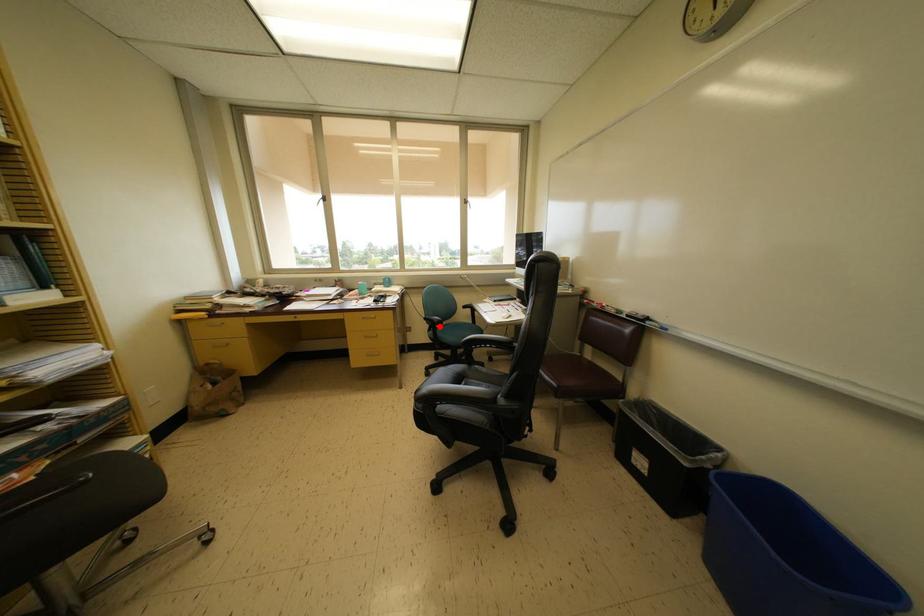
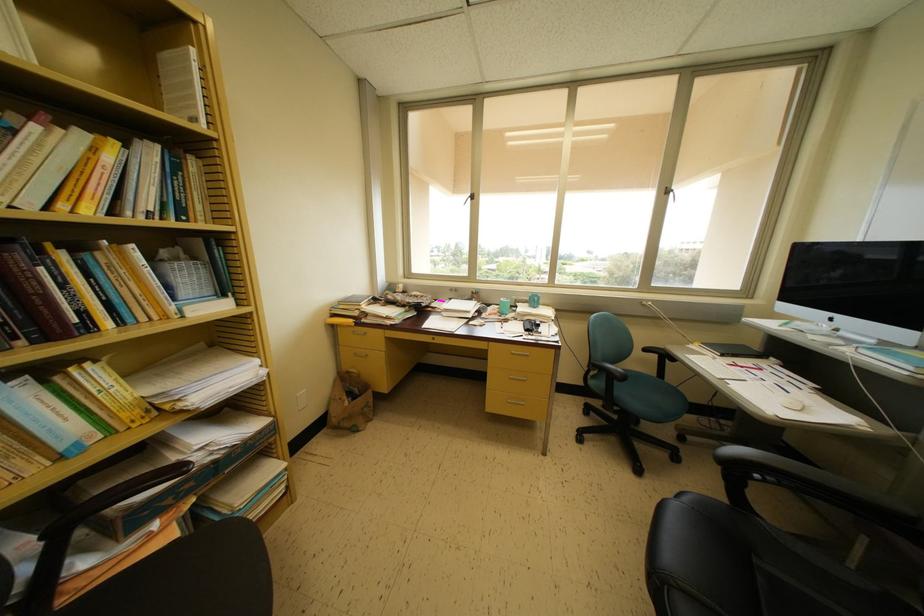
Where in the second image is the point corresponding to the highlighted location from the first image?

(622, 379)